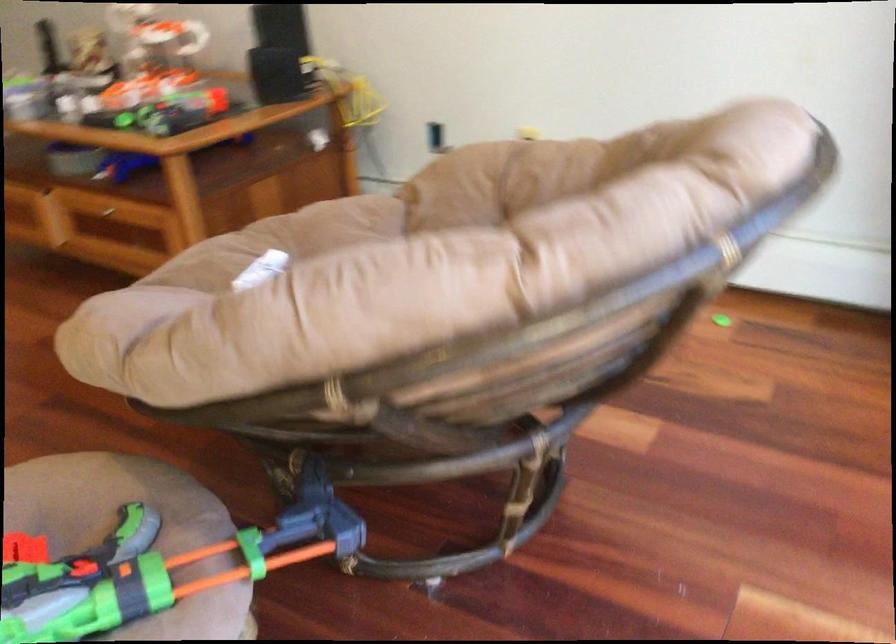
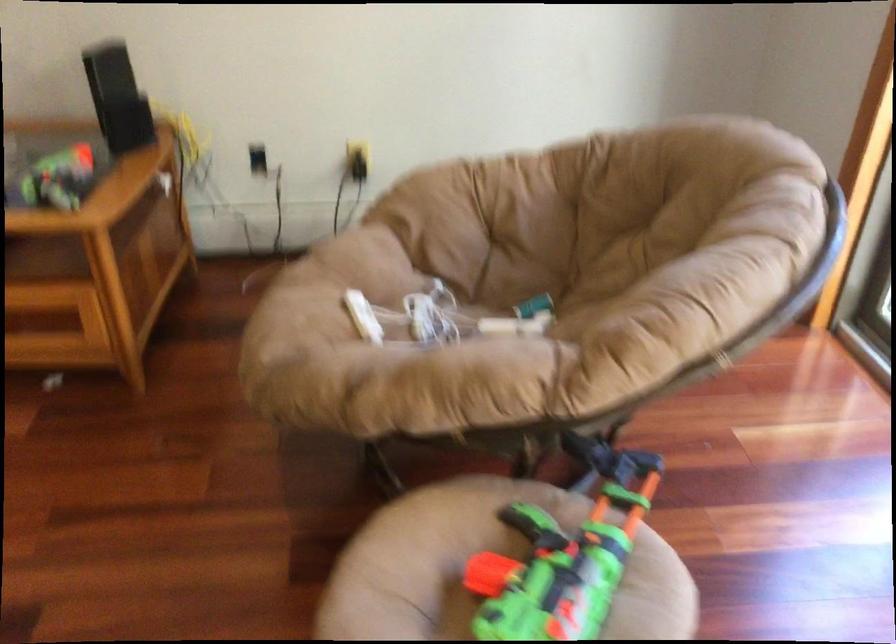
Find the pixel in the second image that matches (x=97, y=516) in the first image.

(530, 520)